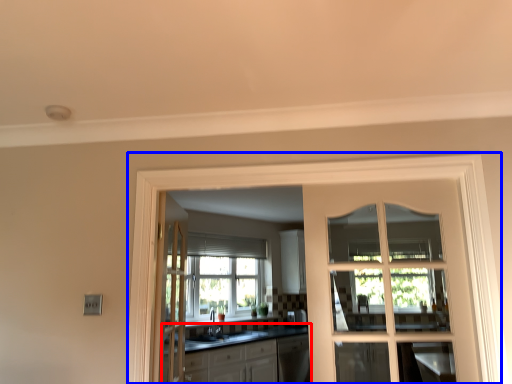
Question: Which point is further to the camera, cabinetry (highlighted by a red box) or window frame (highlighted by a blue box)?

Choices:
 (A) cabinetry
 (B) window frame

Answer: (A)